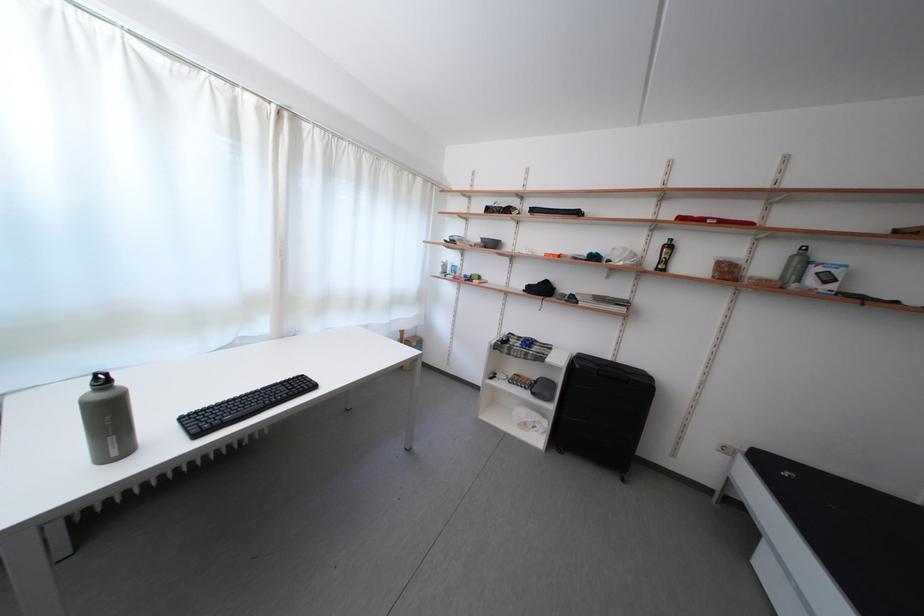
Where is `bottle lid handle`? Image resolution: width=924 pixels, height=616 pixels. bottle lid handle is located at coordinates (101, 379).